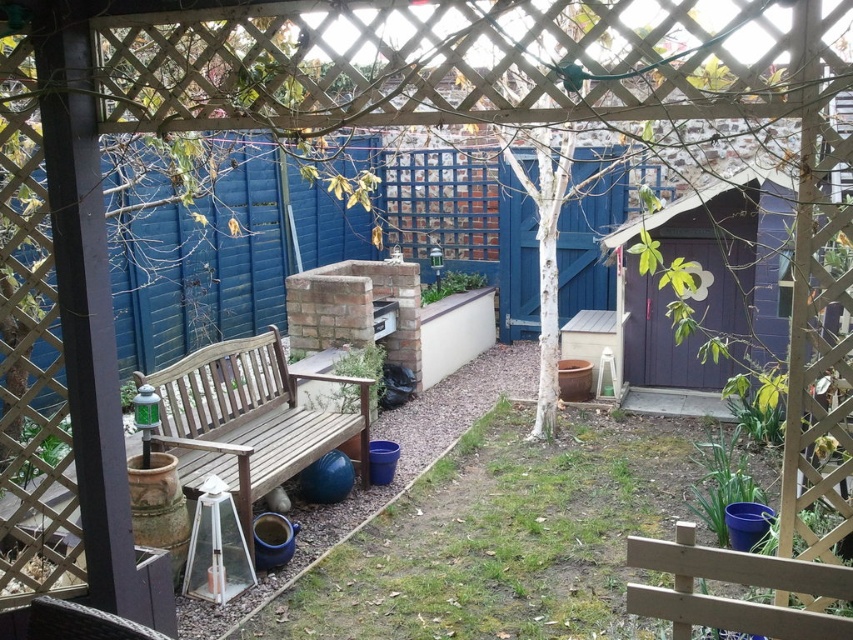
Question: Which point is farther to the camera?

Choices:
 (A) (380, 557)
 (B) (264, 371)

Answer: (B)

Question: Does green grass at center appear over wooden bench at center?

Choices:
 (A) yes
 (B) no

Answer: (B)

Question: Is green grass at center positioned in front of wooden bench at center?

Choices:
 (A) no
 (B) yes

Answer: (B)

Question: Considering the relative positions of green grass at center and wooden bench at center in the image provided, where is green grass at center located with respect to wooden bench at center?

Choices:
 (A) above
 (B) below

Answer: (B)